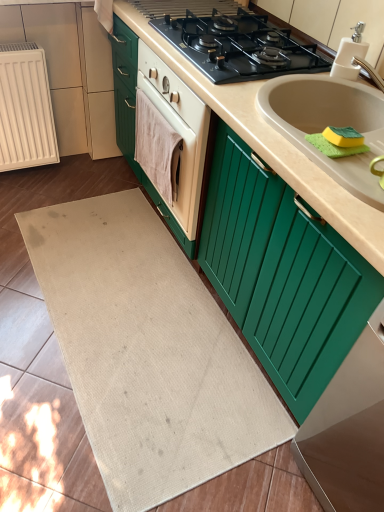
Question: From a real-world perspective, is pink fabric hand towel at center beneath beige matte countertop at center?

Choices:
 (A) no
 (B) yes

Answer: (A)

Question: Can you confirm if pink fabric hand towel at center is taller than beige matte countertop at center?

Choices:
 (A) no
 (B) yes

Answer: (A)

Question: Does pink fabric hand towel at center contain beige matte countertop at center?

Choices:
 (A) yes
 (B) no

Answer: (B)

Question: Is beige matte countertop at center at the back of pink fabric hand towel at center?

Choices:
 (A) yes
 (B) no

Answer: (A)

Question: Does pink fabric hand towel at center have a lesser width compared to beige matte countertop at center?

Choices:
 (A) no
 (B) yes

Answer: (B)

Question: Is pink fabric hand towel at center closer to camera compared to beige matte countertop at center?

Choices:
 (A) no
 (B) yes

Answer: (A)

Question: Is pink fabric hand towel at center next to yellow-green sponge at sink right?

Choices:
 (A) no
 (B) yes

Answer: (A)

Question: Is yellow-green sponge at sink right inside pink fabric hand towel at center?

Choices:
 (A) yes
 (B) no

Answer: (B)

Question: Does pink fabric hand towel at center have a lesser width compared to yellow-green sponge at sink right?

Choices:
 (A) yes
 (B) no

Answer: (A)

Question: Could you tell me if pink fabric hand towel at center is turned towards yellow-green sponge at sink right?

Choices:
 (A) no
 (B) yes

Answer: (A)

Question: From a real-world perspective, is pink fabric hand towel at center positioned over yellow-green sponge at sink right based on gravity?

Choices:
 (A) no
 (B) yes

Answer: (A)

Question: Is the depth of pink fabric hand towel at center greater than that of yellow-green sponge at sink right?

Choices:
 (A) yes
 (B) no

Answer: (A)

Question: Is beige matte countertop at center aimed at white ribbed radiator at left?

Choices:
 (A) yes
 (B) no

Answer: (A)